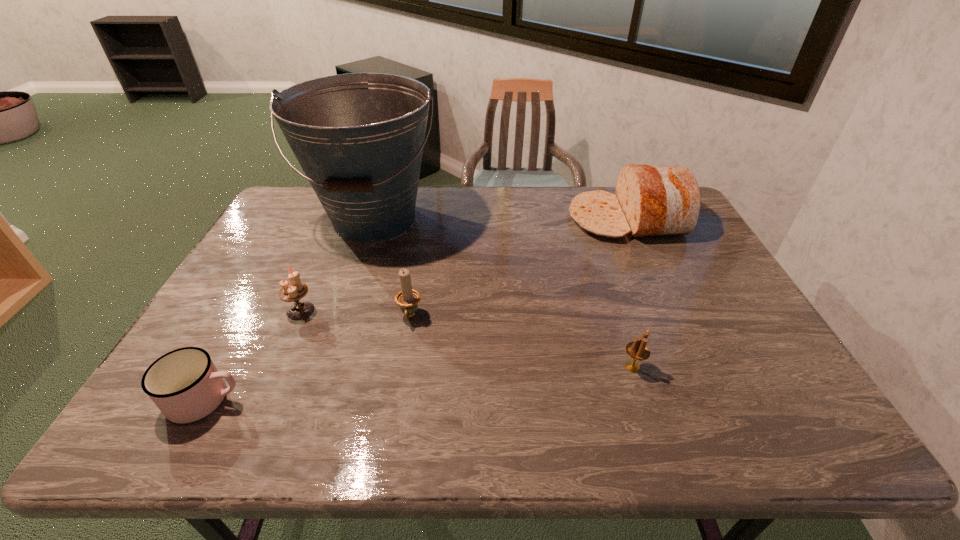
In order to click on free spot between the shortest object and the leftmost candle holder in this screenshot , I will do `click(253, 355)`.

The image size is (960, 540). In order to click on empty space that is in between the fifth shortest object and the tallest object in this screenshot , I will do tap(501, 219).

The width and height of the screenshot is (960, 540). What are the coordinates of `vacant area that lies between the shortest object and the second candle holder from right to left` in the screenshot? It's located at (308, 358).

In order to click on free spot between the second tallest object and the rightmost candle holder in this screenshot , I will do click(x=630, y=293).

The height and width of the screenshot is (540, 960). In order to click on unoccupied area between the nearest candle holder and the bread in this screenshot , I will do `click(630, 293)`.

Find the location of a particular element. object that ranks as the second closest to the nearest candle holder is located at coordinates (408, 298).

This screenshot has width=960, height=540. What are the coordinates of `object that is the closest to the bread` in the screenshot? It's located at (359, 137).

Identify which candle holder is the second nearest to the bread. Please provide its 2D coordinates. Your answer should be formatted as a tuple, i.e. [(x, y)], where the tuple contains the x and y coordinates of a point satisfying the conditions above.

[(408, 298)]

Locate an element on the screen. candle holder that stands as the third closest to the mug is located at coordinates (637, 350).

At what (x,y) coordinates should I click in order to perform the action: click on vacant space that satisfies the following two spatial constraints: 1. on the front side of the leftmost candle holder; 2. on the right side of the nearest candle holder. Please return your answer as a coordinate pair (x, y). This screenshot has width=960, height=540. Looking at the image, I should click on (276, 367).